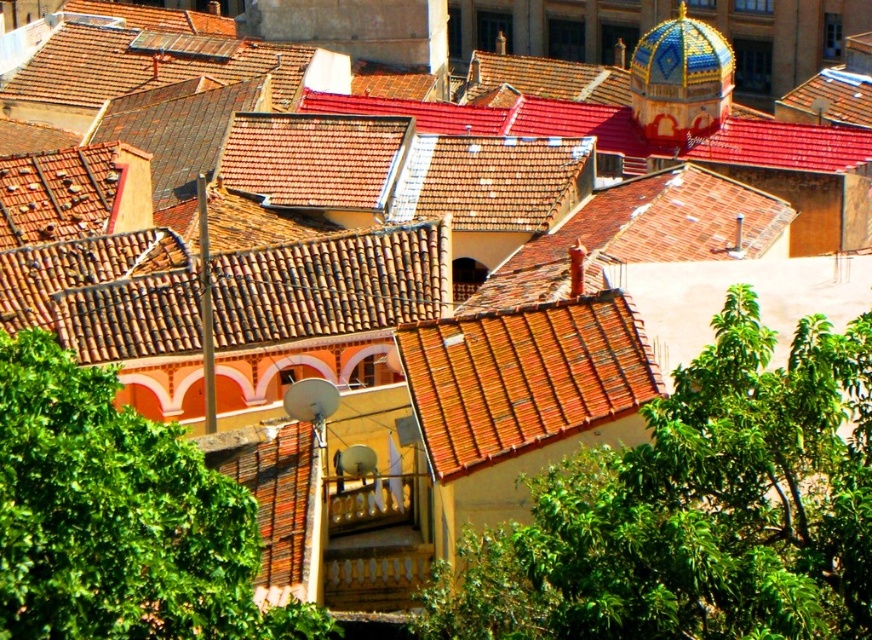
Question: Which point is farther to the camera?

Choices:
 (A) brown tile roof at center
 (B) blue mosaic dome at upper right
 (C) green leafy tree at lower left

Answer: (B)

Question: Which point is farther to the camera?

Choices:
 (A) (138, 472)
 (B) (856, 449)
 (C) (655, 108)
 (D) (489, 433)

Answer: (C)

Question: Observing the image, what is the correct spatial positioning of green leafy tree at center in reference to green leafy tree at lower left?

Choices:
 (A) left
 (B) right

Answer: (B)

Question: Does green leafy tree at center have a larger size compared to blue mosaic dome at upper right?

Choices:
 (A) no
 (B) yes

Answer: (B)

Question: Is brown tile roof at center closer to camera compared to blue mosaic dome at upper right?

Choices:
 (A) yes
 (B) no

Answer: (A)

Question: Which object is positioned farthest from the brown tile roof at center?

Choices:
 (A) green leafy tree at lower left
 (B) blue mosaic dome at upper right
 (C) green leafy tree at center

Answer: (B)